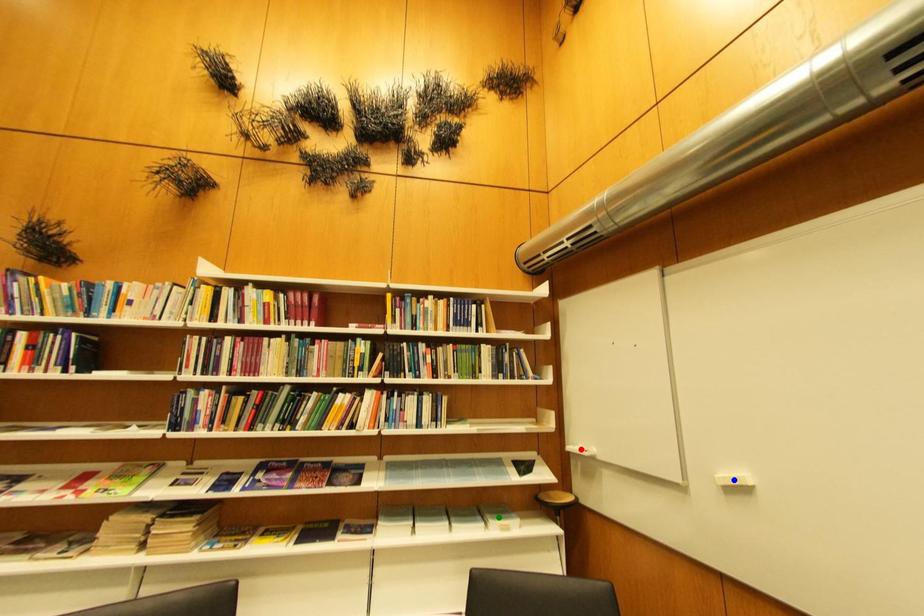
Order these from nearest to farthest:
green point
red point
blue point

blue point < green point < red point